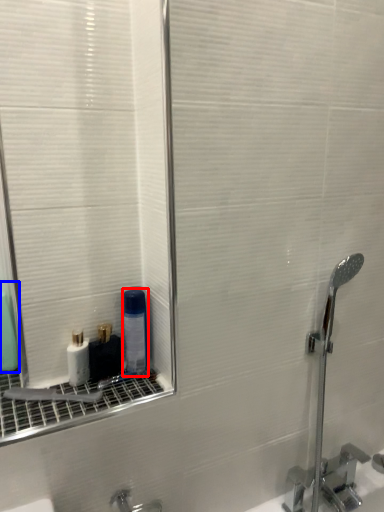
Question: Which object appears farthest to the camera in this image, mouthwash (highlighted by a red box) or mouthwash (highlighted by a blue box)?

Choices:
 (A) mouthwash
 (B) mouthwash

Answer: (B)